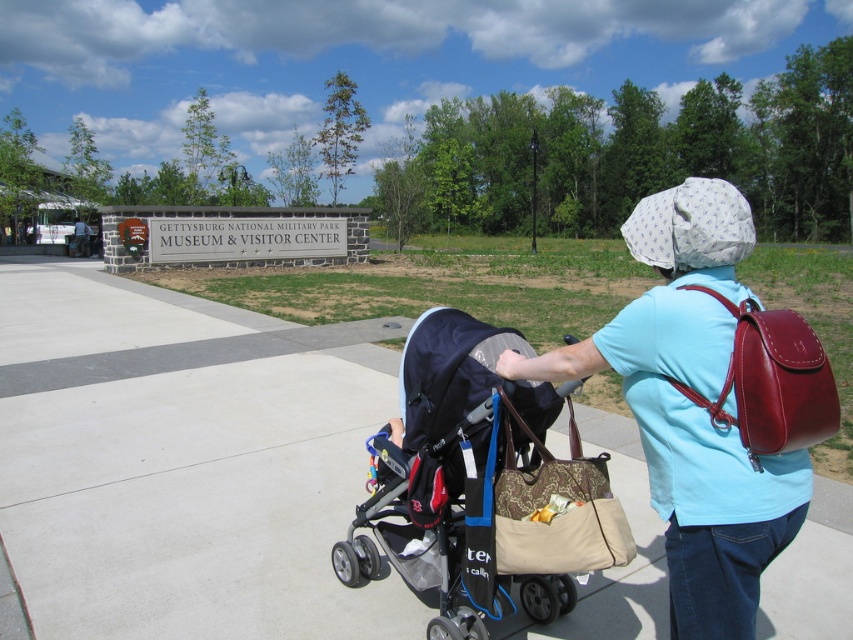
Between light blue cotton shirt at center and beige fabric tote at center, which one appears on the right side from the viewer's perspective?

Positioned to the right is light blue cotton shirt at center.

Looking at this image, who is positioned more to the left, light blue cotton shirt at center or beige fabric tote at center?

beige fabric tote at center

Which is behind, point (677, 552) or point (587, 529)?

The point (587, 529) is more distant.

What are the coordinates of `light blue cotton shirt at center` in the screenshot? It's located at (654, 326).

Based on the photo, is light blue cotton shirt at center closer to the viewer compared to shiny burgundy leather backpack at upper right?

No, light blue cotton shirt at center is behind shiny burgundy leather backpack at upper right.

Who is more distant from viewer, (569,372) or (770,340)?

The point (569,372) is more distant.

Identify the location of light blue cotton shirt at center. This screenshot has width=853, height=640. (654, 326).

This screenshot has width=853, height=640. What are the coordinates of `light blue cotton shirt at center` in the screenshot? It's located at (654, 326).

How much distance is there between beige fabric tote at center and shiny burgundy leather backpack at upper right?

They are 69.39 centimeters apart.

Is beige fabric tote at center closer to the viewer compared to shiny burgundy leather backpack at upper right?

No, beige fabric tote at center is behind shiny burgundy leather backpack at upper right.

This screenshot has height=640, width=853. I want to click on beige fabric tote at center, so click(556, 509).